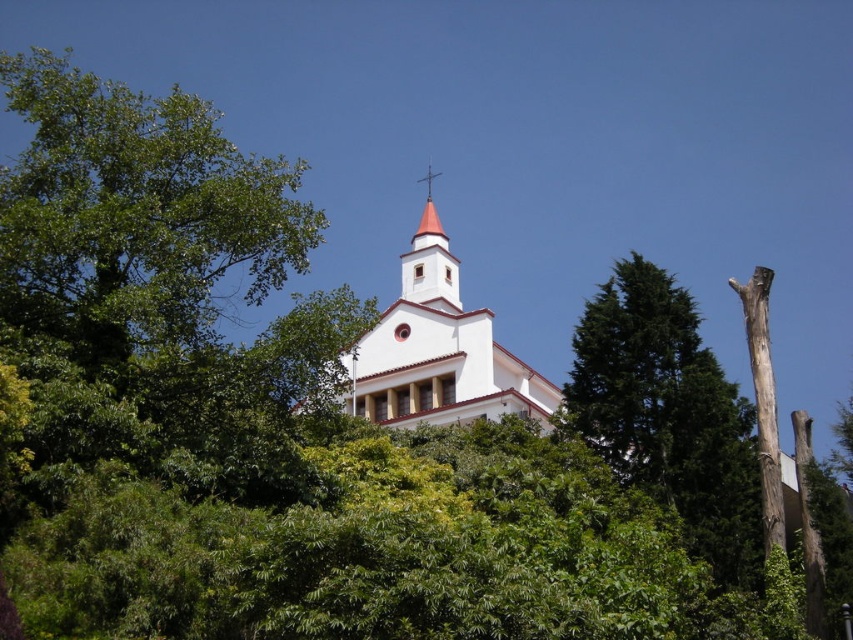
Question: Among these points, which one is nearest to the camera?

Choices:
 (A) (645, 289)
 (B) (502, 406)

Answer: (A)

Question: Which point appears farthest from the camera in this image?

Choices:
 (A) 614,324
 (B) 428,236

Answer: (B)

Question: Observing the image, what is the correct spatial positioning of green textured tree at right in reference to white stucco church at center?

Choices:
 (A) below
 (B) above

Answer: (B)

Question: Can you confirm if green textured tree at right is thinner than white stucco church at center?

Choices:
 (A) yes
 (B) no

Answer: (A)

Question: Can you confirm if green textured tree at right is positioned above white stucco church at center?

Choices:
 (A) yes
 (B) no

Answer: (A)